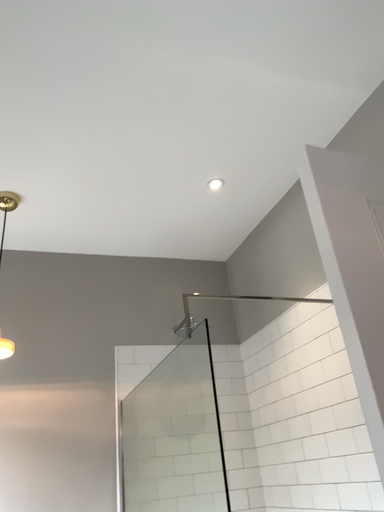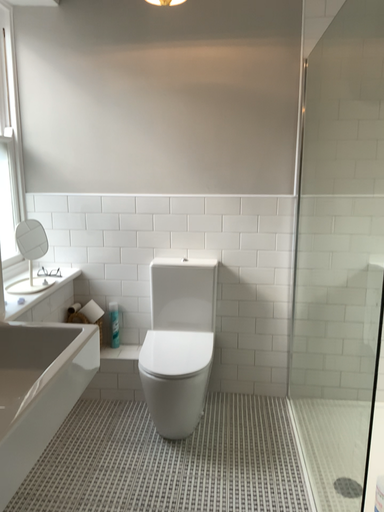
Question: How did the camera likely rotate when shooting the video?

Choices:
 (A) rotated left
 (B) rotated right

Answer: (A)